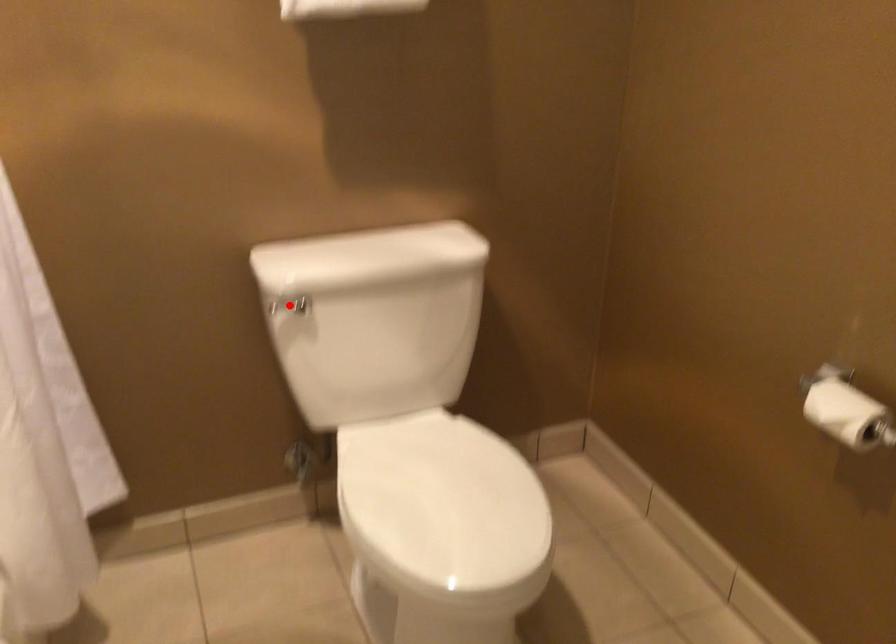
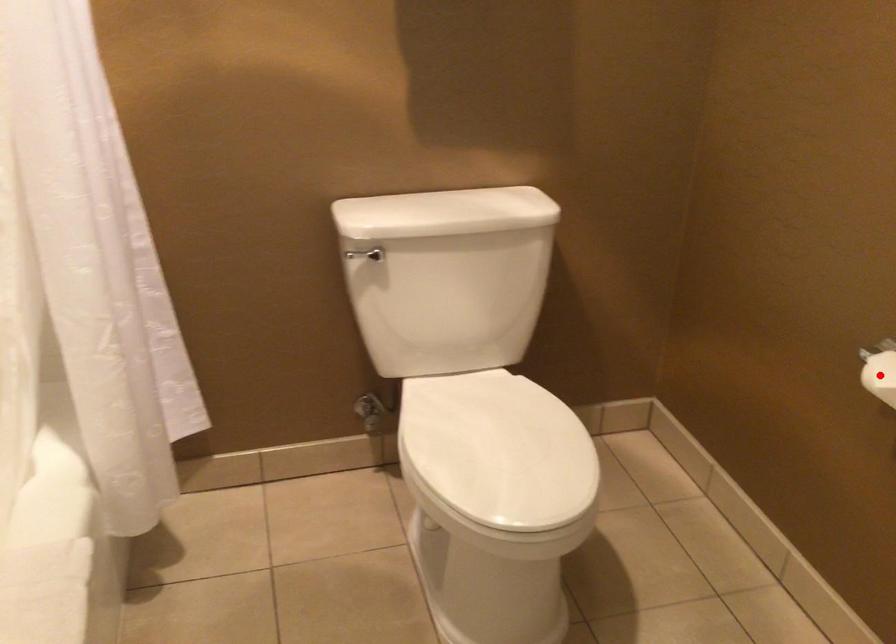
Looking at this image, I am providing you with two images of the same scene from different viewpoints. A red point is marked on the first image and another point is marked on the second image. Is the marked point in image1 the same physical position as the marked point in image2?

No